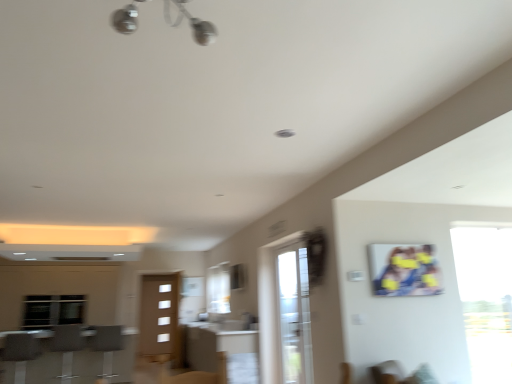
Question: Is point (297, 349) closer or farther from the camera than point (489, 238)?

Choices:
 (A) closer
 (B) farther

Answer: (B)

Question: From a real-world perspective, is clear glass screen door at center positioned above or below transparent glass window at right?

Choices:
 (A) below
 (B) above

Answer: (A)

Question: Based on their relative distances, which object is farther from the metallic chrome light fixture at upper center?

Choices:
 (A) clear glass screen door at center
 (B) metallic silver barstools at lower left
 (C) transparent glass window at right
 (D) matte brown table at center

Answer: (D)

Question: Based on their relative distances, which object is nearer to the metallic chrome light fixture at upper center?

Choices:
 (A) matte brown table at center
 (B) metallic silver barstools at lower left
 (C) transparent glass window at right
 (D) clear glass screen door at center

Answer: (D)